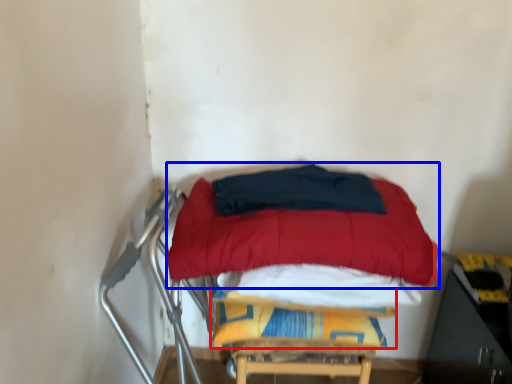
Question: Which object appears closest to the camera in this image, blanket (highlighted by a red box) or mattress (highlighted by a blue box)?

Choices:
 (A) blanket
 (B) mattress

Answer: (B)